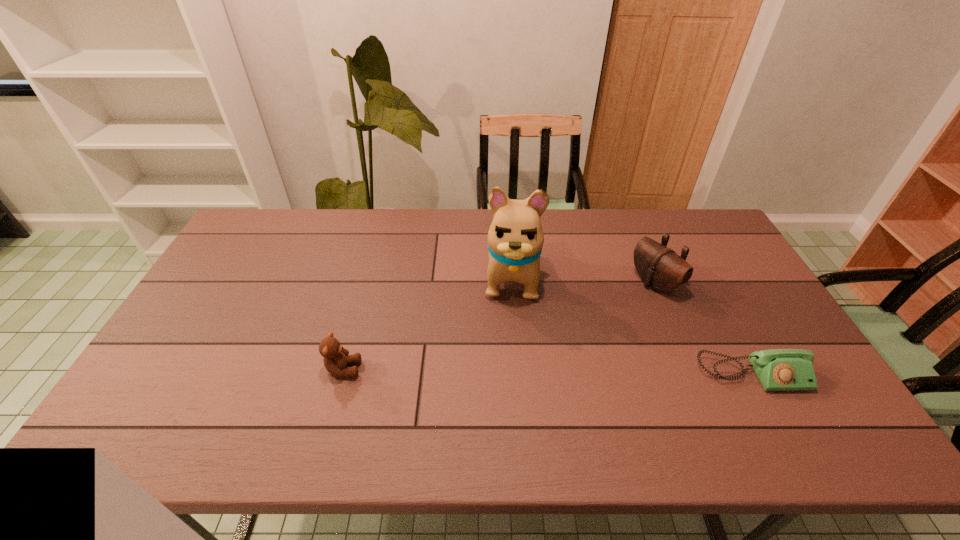
Identify the location of the third tallest object. This screenshot has height=540, width=960. (336, 358).

At what (x,y) coordinates should I click in order to perform the action: click on teddy bear. Please return your answer as a coordinate pair (x, y). Image resolution: width=960 pixels, height=540 pixels. Looking at the image, I should click on (336, 358).

Where is `telephone`? telephone is located at coordinates (777, 369).

You are a GUI agent. You are given a task and a screenshot of the screen. Output one action in this format:
    pyautogui.click(x=<x>, y=<y>)
    Task: Click on the second object from left to right
    
    Given the screenshot: What is the action you would take?
    pyautogui.click(x=515, y=238)

The height and width of the screenshot is (540, 960). I want to click on the tallest object, so click(515, 238).

Identify the location of the second tallest object. This screenshot has height=540, width=960. (660, 268).

I want to click on vacant space located 0.120m on the face of the third tallest object, so click(406, 369).

The width and height of the screenshot is (960, 540). I want to click on vacant space located 0.120m on the face of the puppy, so click(x=510, y=341).

Image resolution: width=960 pixels, height=540 pixels. I want to click on vacant space situated 0.070m on the face of the puppy, so click(511, 327).

What are the coordinates of `vacant space situated 0.050m on the face of the puppy` in the screenshot? It's located at (511, 322).